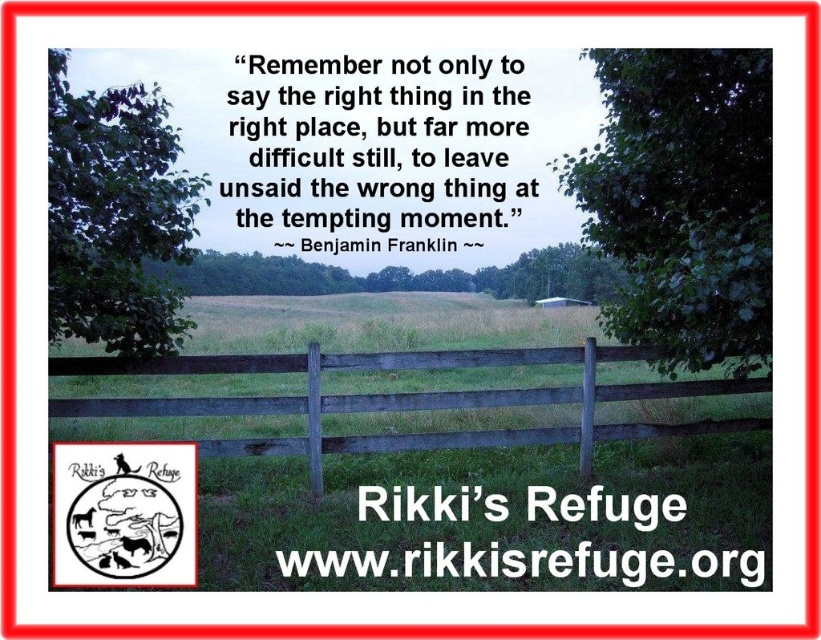
Question: Does weathered wood fence at center appear on the left side of white paper at center?

Choices:
 (A) no
 (B) yes

Answer: (A)

Question: Which object is closer to the camera taking this photo?

Choices:
 (A) green leafy tree at upper right
 (B) weathered wood fence at center

Answer: (A)

Question: Which of the following is the closest to the observer?

Choices:
 (A) weathered wood fence at center
 (B) white paper at center
 (C) green leafy tree at upper left

Answer: (B)

Question: Where is green leafy tree at upper left located in relation to white paper at center in the image?

Choices:
 (A) below
 (B) above

Answer: (B)

Question: Among these points, which one is farthest from the camera?

Choices:
 (A) (190, 520)
 (B) (437, 360)
 (C) (621, 323)
 (D) (579, 252)

Answer: (D)

Question: Can you confirm if weathered wood fence at center is bigger than green leafy tree at center?

Choices:
 (A) no
 (B) yes

Answer: (A)